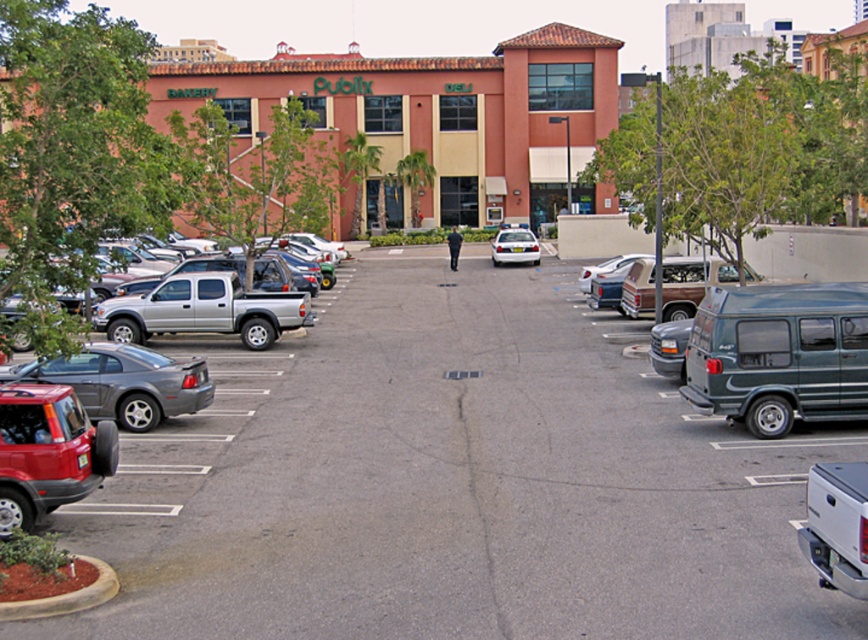
You are a customer arriving at the Publix store and need to park your car. You see the shiny red suv at lower left and the silver metallic sedan at center. Which parking spot is closer to the entrance if you want to minimize walking distance?

The silver metallic sedan at center is closer to the entrance than the shiny red suv at lower left because it is positioned centrally, which is typically closer to the store entrance in parking layouts.

You are a delivery driver who needs to park your truck in the Publix parking lot. You see the gray asphalt parking lot at center and the metallic gray car at left. Which parking spot is closer to the store entrance?

The metallic gray car at left is parked closer to the store entrance because the gray asphalt parking lot at center is in front of it, meaning the car is behind the central parking area and farther from the entrance.

You are standing at the entrance of the Publix grocery store. Where is the gray asphalt parking lot at center in relation to your position?

The gray asphalt parking lot at center is located at point (452, 481) relative to your position at the entrance.